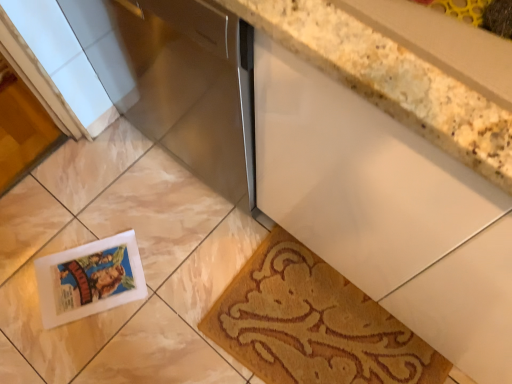
Image resolution: width=512 pixels, height=384 pixels. What are the coordinates of `free space between brown textured mat at lower right and white glossy postcard at lower left` in the screenshot? It's located at point(169,298).